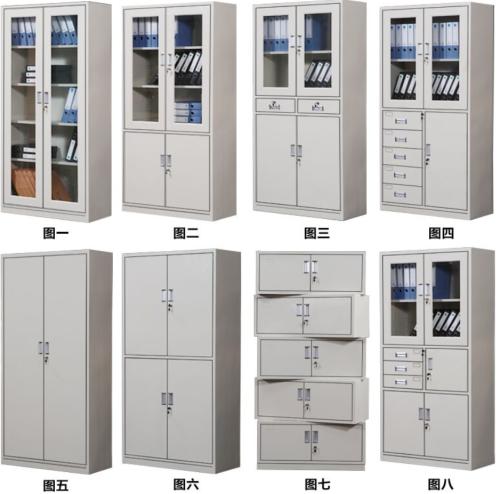
This screenshot has height=494, width=500. In order to click on glass door and drawer cabinet  top right corner in this screenshot , I will do `click(442, 118)`.